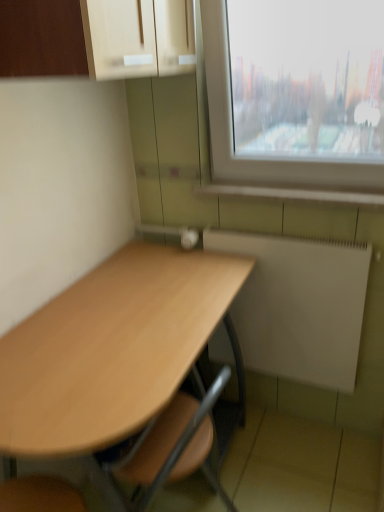
Find the location of `free space above light brown wood desk at center (from a real-world perspective)`. free space above light brown wood desk at center (from a real-world perspective) is located at coordinates (123, 322).